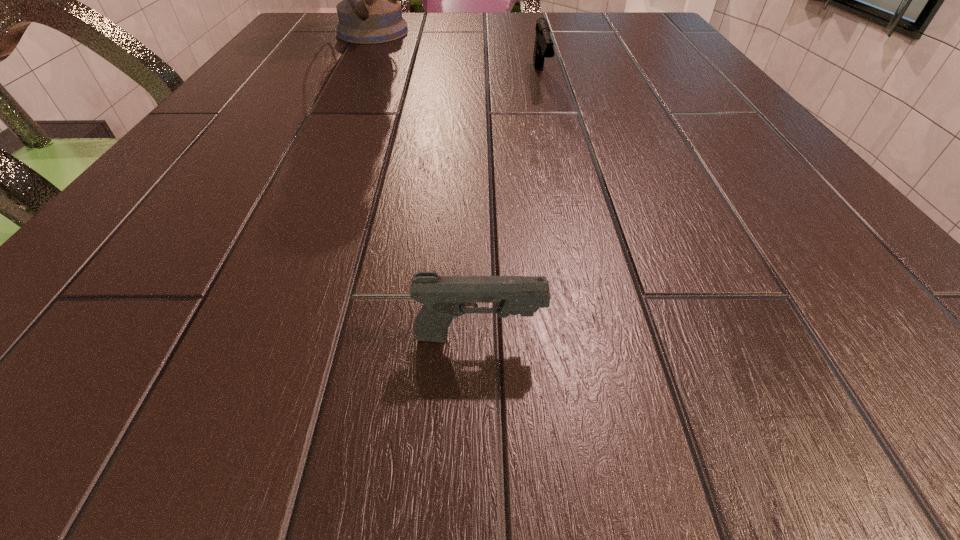
At what (x,y) coordinates should I click in order to perform the action: click on the farthest object. Please return your answer as a coordinate pair (x, y). Looking at the image, I should click on (369, 12).

The height and width of the screenshot is (540, 960). I want to click on the tallest object, so click(x=369, y=12).

Where is `the second farthest object`? the second farthest object is located at coordinates (543, 47).

The image size is (960, 540). Find the location of `the right pistol`. the right pistol is located at coordinates (543, 47).

Find the location of a particular element. the nearer pistol is located at coordinates coord(443,297).

The width and height of the screenshot is (960, 540). I want to click on the second object from left to right, so click(443, 297).

Where is `free space located 0.280m on the right of the tallest object`? free space located 0.280m on the right of the tallest object is located at coordinates (527, 32).

At what (x,y) coordinates should I click in order to perform the action: click on vacant area situated on the front-facing side of the right pistol. Please return your answer as a coordinate pair (x, y). The height and width of the screenshot is (540, 960). Looking at the image, I should click on (x=572, y=212).

At what (x,y) coordinates should I click in order to perform the action: click on free spot located 0.050m at the barrel of the nearer pistol. Please return your answer as a coordinate pair (x, y). The image size is (960, 540). Looking at the image, I should click on (594, 336).

Where is `object at the far edge`? The width and height of the screenshot is (960, 540). object at the far edge is located at coordinates (369, 12).